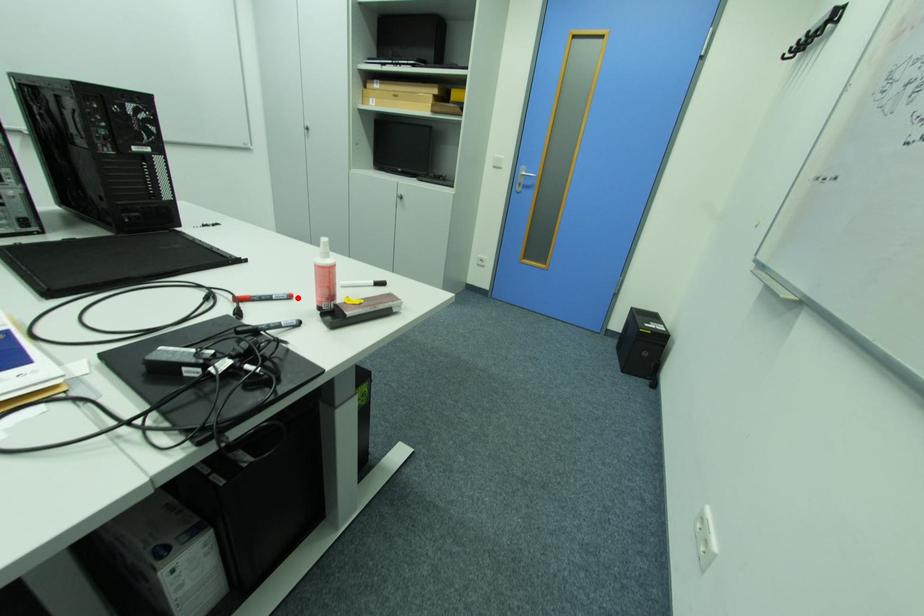
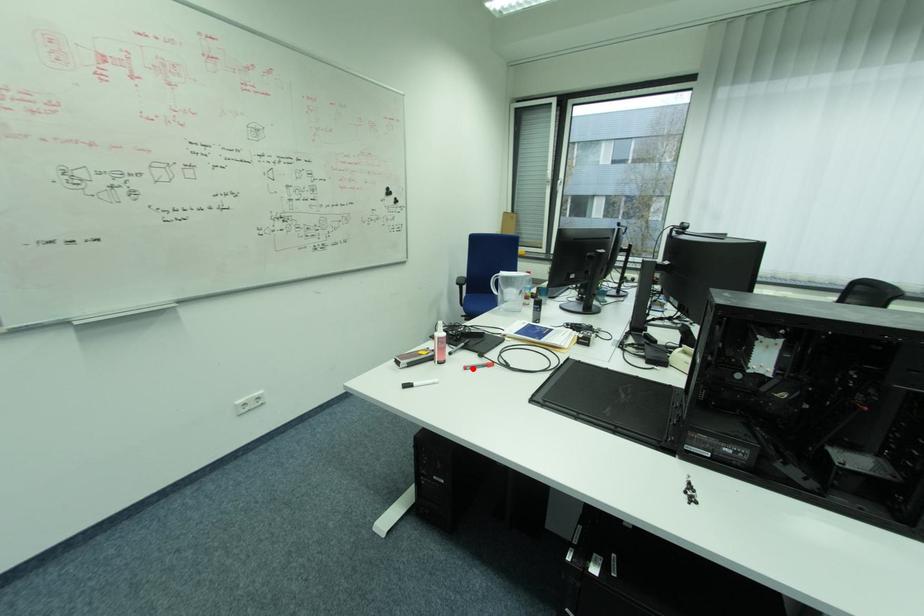
I am providing you with two images of the same scene from different viewpoints. A red point is marked on the first image and another point is marked on the second image. Does the point marked in image1 correspond to the same location as the one in image2?

Yes